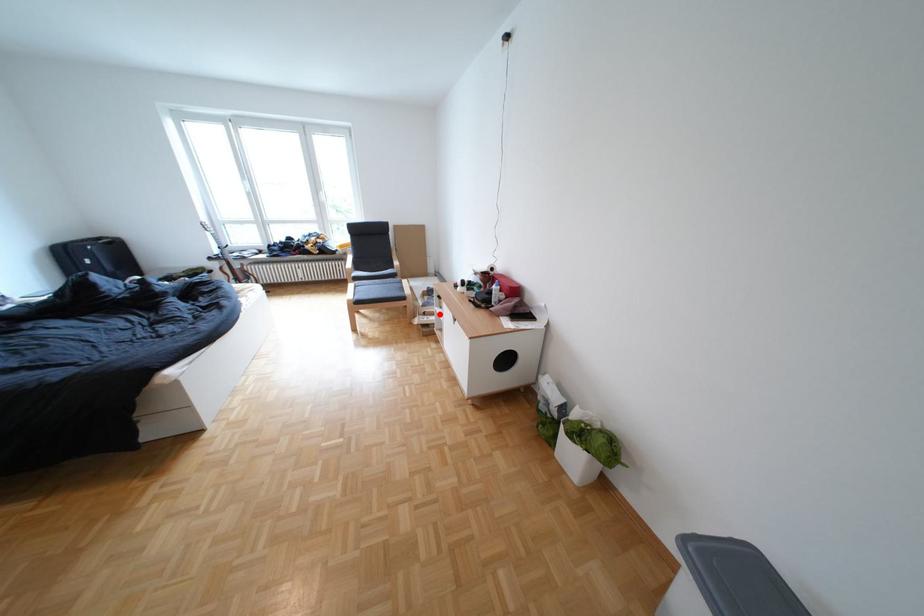
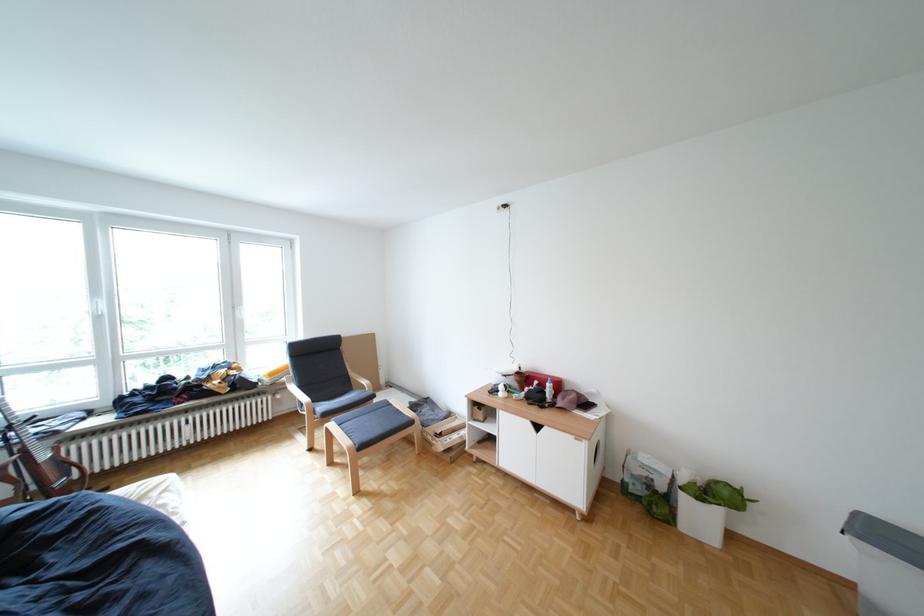
The point at the highlighted location is marked in the first image. Where is the corresponding point in the second image?

(456, 436)